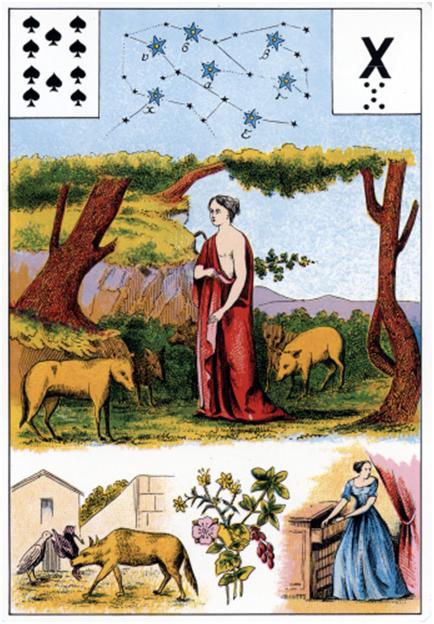
The height and width of the screenshot is (624, 434). Find the location of `plant`. plant is located at coordinates (230, 527).